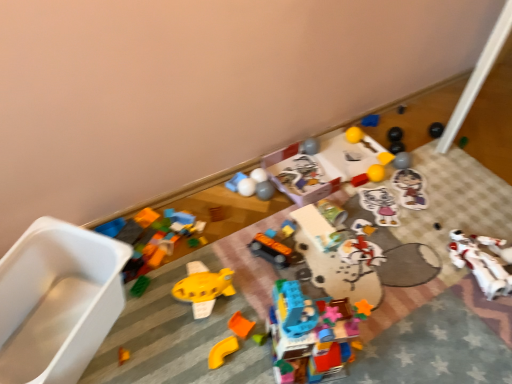
Find the location of a particular element. free space to the back side of orange matte block at center, which is the thirteenth toy from right to left is located at coordinates (247, 281).